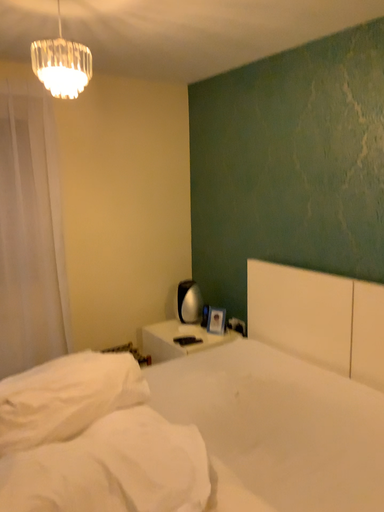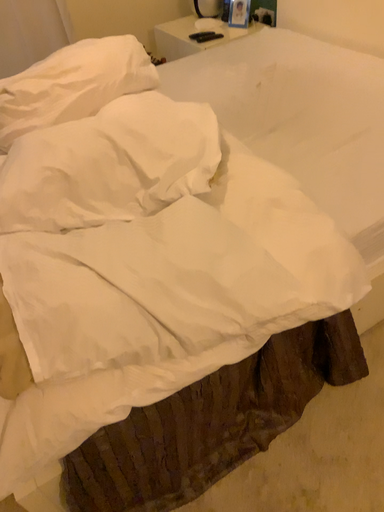
Question: How did the camera likely rotate when shooting the video?

Choices:
 (A) rotated downward
 (B) rotated upward

Answer: (A)